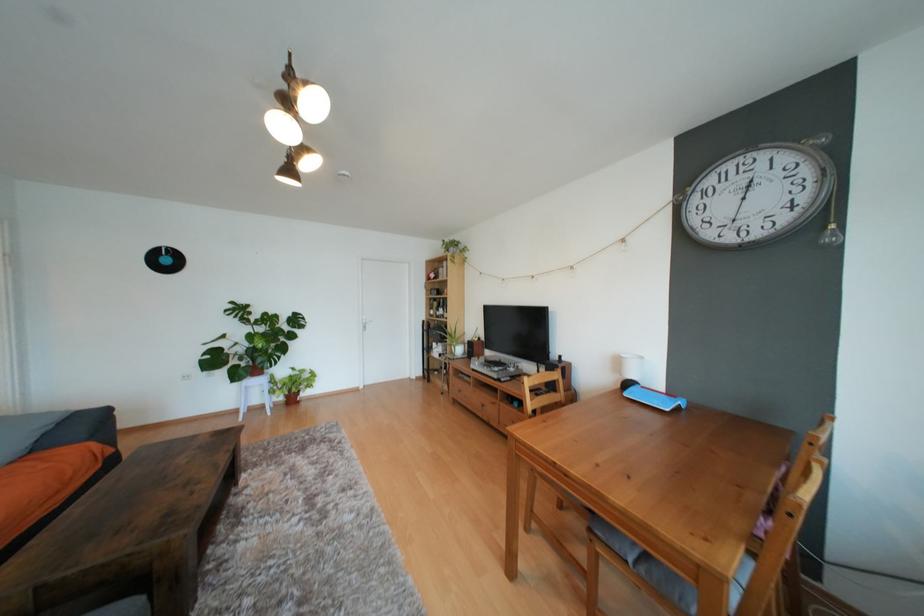
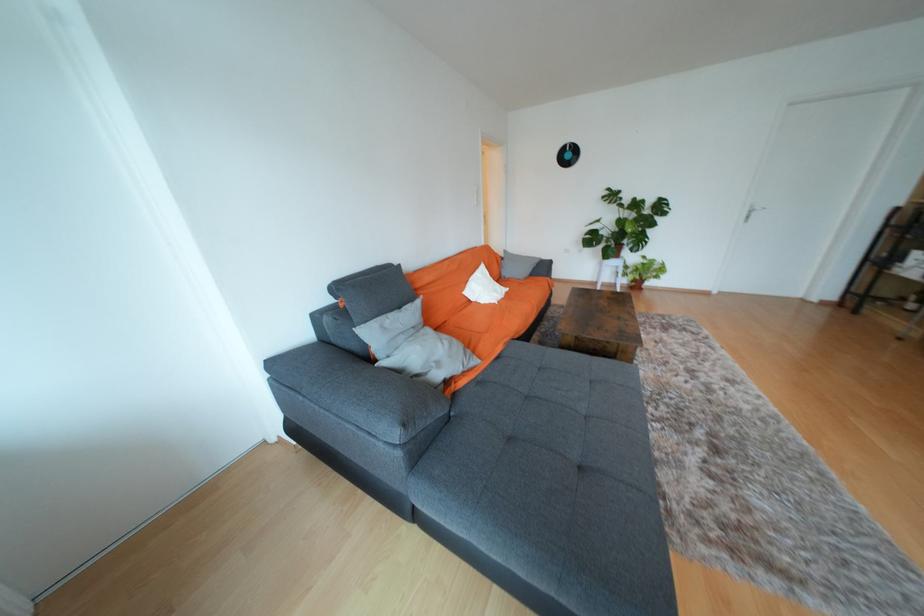
In the second image, find the point that corresponds to pixel 172 262 in the first image.

(574, 156)